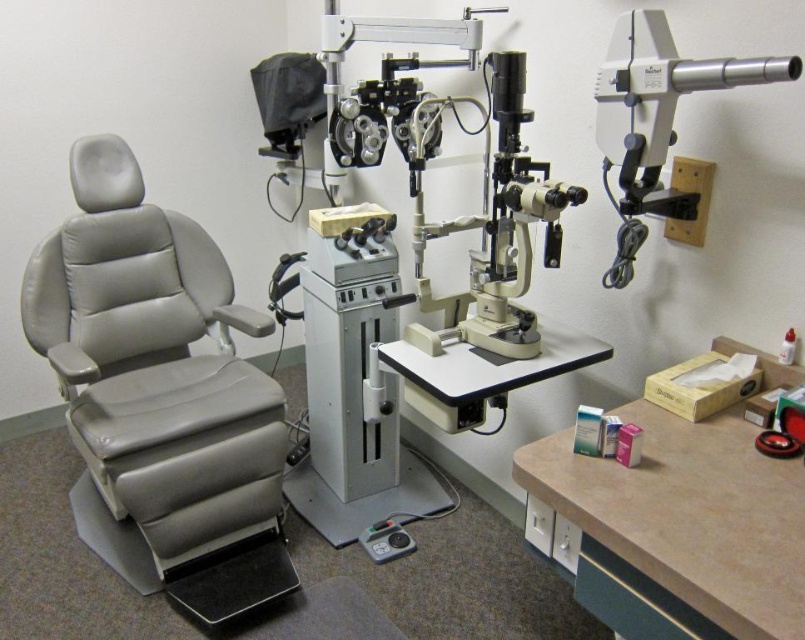
You are an optometrist who needs to place a 1.2 meter wide box on either the beige laminate table at lower right or the white plastic telescope at upper right. Based on their sizes, which surface can accommodate the box?

The beige laminate table at lower right can accommodate the 1.2 meter wide box since its width is larger than that of the white plastic telescope at upper right.

You are a patient who needs to sit in the gray leather swivel chair at left to have an eye exam. The white plastic telescope at upper right is part of the slit lamp machine. Can you sit down in the chair without hitting your head on the telescope?

The gray leather swivel chair at left is much taller than the white plastic telescope at upper right, so you can sit down without hitting your head on the telescope.